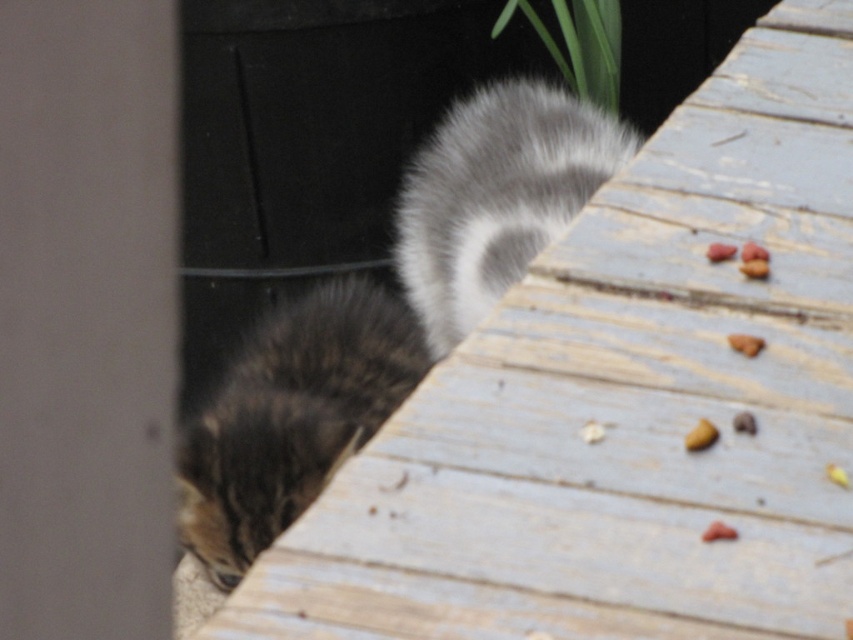
Looking at this image, is tabby fur cat at lower left shorter than brown crumbly food at right?

No, tabby fur cat at lower left is not shorter than brown crumbly food at right.

Where is `tabby fur cat at lower left`? The height and width of the screenshot is (640, 853). tabby fur cat at lower left is located at coordinates (291, 417).

Can you confirm if green leafy plant at upper center is bigger than yellow matte food at lower right?

Yes.

Can you confirm if green leafy plant at upper center is wider than yellow matte food at lower right?

Correct, the width of green leafy plant at upper center exceeds that of yellow matte food at lower right.

Where is `green leafy plant at upper center`? green leafy plant at upper center is located at coordinates (579, 44).

Can you confirm if fuzzy fur tail at upper right is positioned below green leafy plant at upper center?

Yes.

Is fuzzy fur tail at upper right taller than green leafy plant at upper center?

Yes.

Identify the location of fuzzy fur tail at upper right. (496, 196).